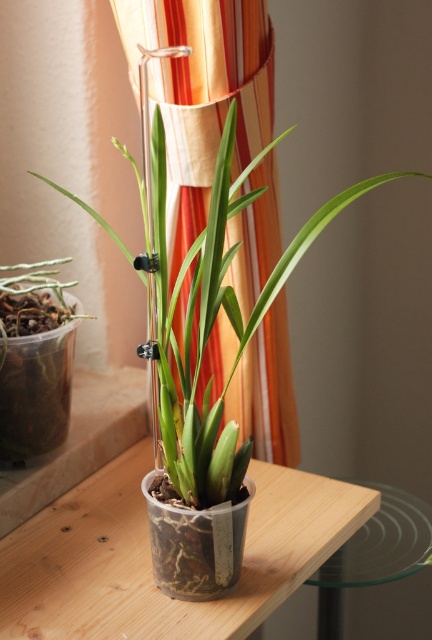
Question: Which point is closer to the camera taking this photo?

Choices:
 (A) (254, 584)
 (B) (146, 282)

Answer: (B)

Question: Does wooden table at center have a greater width compared to transparent plastic pot at left?

Choices:
 (A) yes
 (B) no

Answer: (A)

Question: Which point is closer to the camera?

Choices:
 (A) green matte plant at center
 (B) orange striped curtain at center
 (C) transparent glass table at lower right

Answer: (A)

Question: Estimate the real-world distances between objects in this image. Which object is farther from the wooden table at center?

Choices:
 (A) transparent glass table at lower right
 (B) matte plastic vase at center
 (C) green matte plant at center

Answer: (A)

Question: Observing the image, what is the correct spatial positioning of matte plastic vase at center in reference to transparent glass table at lower right?

Choices:
 (A) left
 (B) right

Answer: (A)

Question: Is orange striped curtain at center below matte plastic vase at center?

Choices:
 (A) yes
 (B) no

Answer: (B)